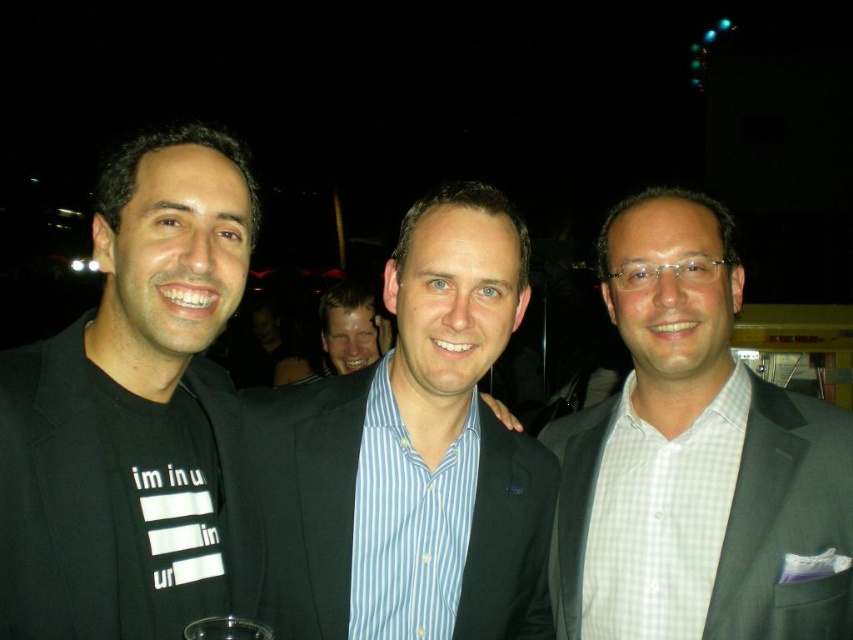
Can you confirm if black matte suit at center is shorter than gray checkered shirt at center?

Indeed, black matte suit at center has a lesser height compared to gray checkered shirt at center.

How far apart are black matte suit at center and gray checkered shirt at center?

They are 29.36 inches apart.

The width and height of the screenshot is (853, 640). What do you see at coordinates (132, 410) in the screenshot? I see `black matte suit at center` at bounding box center [132, 410].

Find the location of a particular element. The image size is (853, 640). black matte suit at center is located at coordinates (132, 410).

Who is positioned more to the right, blue striped shirt at center or gray checkered shirt at center?

Positioned to the right is gray checkered shirt at center.

Can you confirm if blue striped shirt at center is shorter than gray checkered shirt at center?

Indeed, blue striped shirt at center has a lesser height compared to gray checkered shirt at center.

Describe the element at coordinates (410, 458) in the screenshot. I see `blue striped shirt at center` at that location.

At what (x,y) coordinates should I click in order to perform the action: click on blue striped shirt at center. Please return your answer as a coordinate pair (x, y). Looking at the image, I should click on (410, 458).

Does black matte suit at center have a lesser height compared to blue striped shirt at center?

Indeed, black matte suit at center has a lesser height compared to blue striped shirt at center.

Based on the photo, between black matte suit at center and blue striped shirt at center, which one appears on the right side from the viewer's perspective?

From the viewer's perspective, blue striped shirt at center appears more on the right side.

Between point (22, 504) and point (334, 577), which one is positioned behind?

Positioned behind is point (334, 577).

Locate an element on the screen. black matte suit at center is located at coordinates (132, 410).